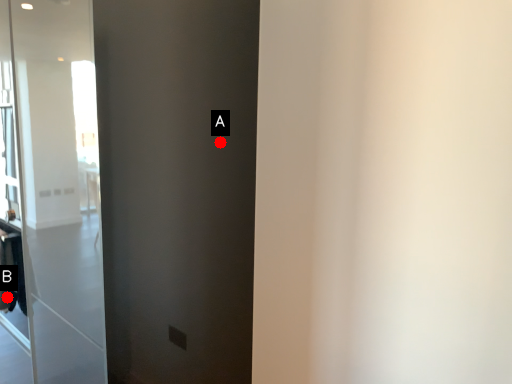
Question: Two points are circled on the image, labeled by A and B beside each circle. Which point appears closest to the camera in this image?

Choices:
 (A) A is closer
 (B) B is closer

Answer: (A)